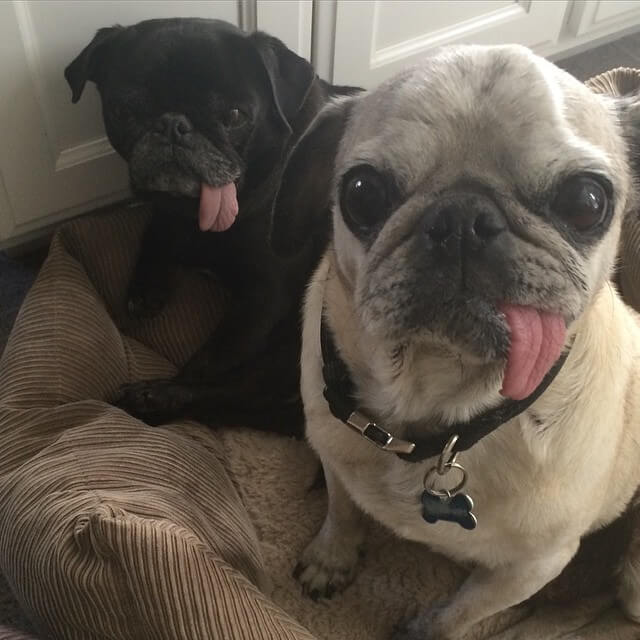
Identify the location of dog bed. The image size is (640, 640). (134, 516).